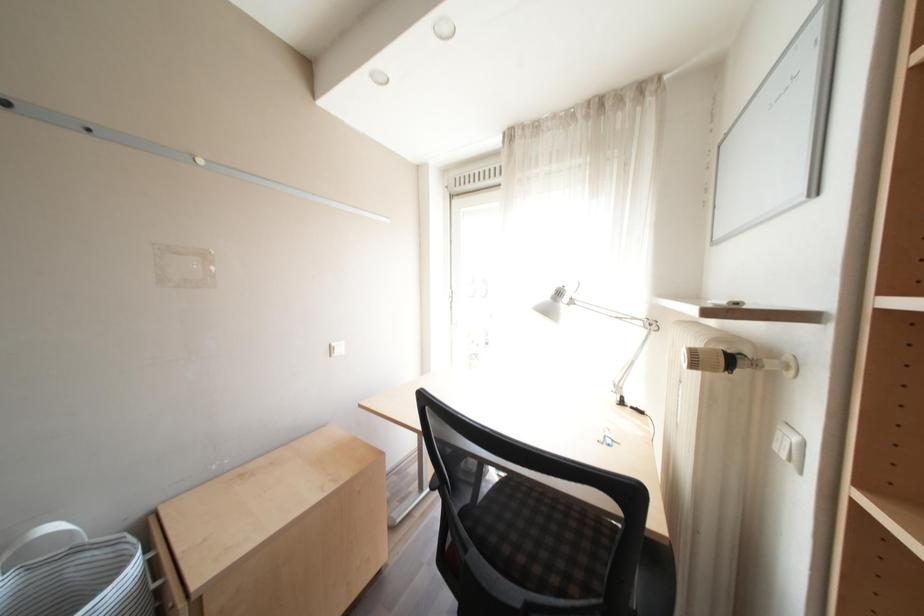
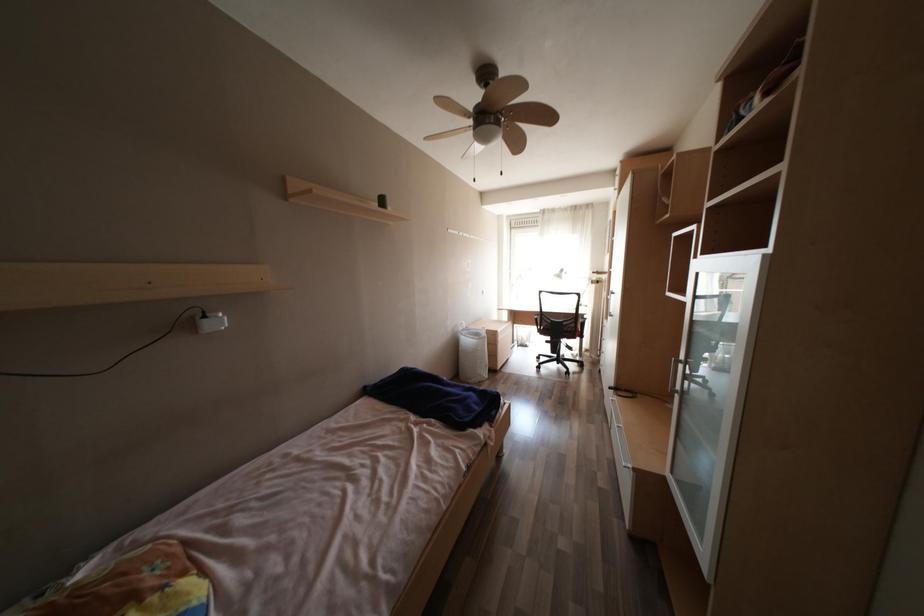
What movement of the cameraman would produce the second image?

The movement direction of the cameraman is left, backward.